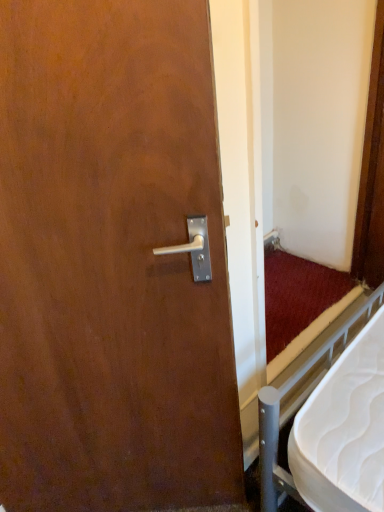
What is the approximate width of matte wood door at center?

matte wood door at center is 5.53 inches wide.

Find the location of a particular element. This screenshot has width=384, height=512. matte wood door at center is located at coordinates (111, 262).

Measure the distance between point (115, 233) and camera.

They are 85.80 centimeters apart.

Describe the element at coordinates (111, 262) in the screenshot. I see `matte wood door at center` at that location.

The image size is (384, 512). I want to click on matte wood door at center, so click(x=111, y=262).